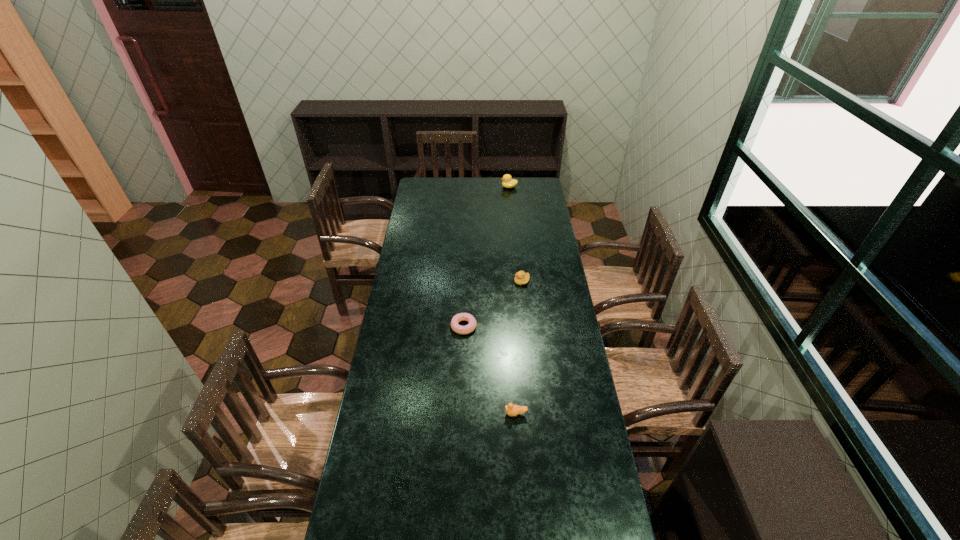
At what (x,y) coordinates should I click in order to perform the action: click on vacant space in between the third nearest object and the nearest duckling. Please return your answer as a coordinate pair (x, y). This screenshot has height=540, width=960. Looking at the image, I should click on (518, 347).

Identify the location of vacant area that lies between the nearest object and the tallest object. (513, 300).

This screenshot has width=960, height=540. I want to click on free space between the nearest object and the tallest object, so click(513, 300).

Where is `vacant area between the nearest duckling and the second farthest object`? vacant area between the nearest duckling and the second farthest object is located at coordinates (518, 347).

Where is `vacant area that lies between the doughnut and the nearest object`? This screenshot has width=960, height=540. vacant area that lies between the doughnut and the nearest object is located at coordinates (490, 370).

The height and width of the screenshot is (540, 960). I want to click on unoccupied area between the second farthest duckling and the leftmost object, so (x=492, y=303).

Identify the location of free space between the second nearest duckling and the nearest object. (518, 347).

Find the location of a particular element. blank region between the tallest duckling and the nearest duckling is located at coordinates (513, 300).

I want to click on free space that is in between the third nearest object and the nearest object, so click(x=518, y=347).

This screenshot has width=960, height=540. I want to click on free spot between the farthest duckling and the second nearest duckling, so click(x=516, y=234).